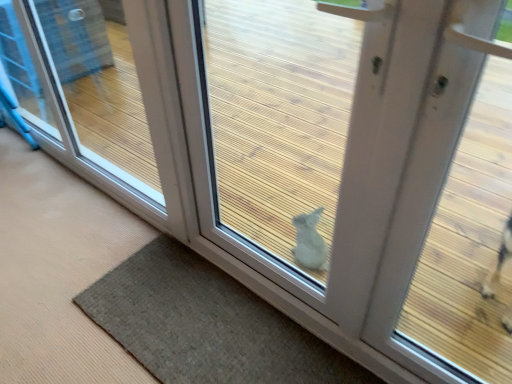
This screenshot has width=512, height=384. In order to click on transparent glass door at lower right in this screenshot , I will do `click(99, 89)`.

Looking at the image, does brown textured mat at lower center seem bigger or smaller compared to white matte door at center?

In the image, brown textured mat at lower center appears to be smaller than white matte door at center.

From the image's perspective, is brown textured mat at lower center located above or below white matte door at center?

brown textured mat at lower center is situated lower than white matte door at center in the image.

Does brown textured mat at lower center turn towards white matte door at center?

No, brown textured mat at lower center is not oriented towards white matte door at center.

Is brown textured mat at lower center beside white matte door at center?

brown textured mat at lower center is not next to white matte door at center, and they're not touching.

Which object is more forward, transparent glass door at lower right or brown textured mat at lower center?

Positioned in front is brown textured mat at lower center.

Is transparent glass door at lower right far from brown textured mat at lower center?

That's right, there is a large distance between transparent glass door at lower right and brown textured mat at lower center.

Is transparent glass door at lower right inside the boundaries of brown textured mat at lower center, or outside?

transparent glass door at lower right is not inside brown textured mat at lower center, it's outside.

From a real-world perspective, which object stands above the other?

transparent glass door at lower right, from a real-world perspective.

Is brown textured mat at lower center touching transparent glass door at lower right?

No, brown textured mat at lower center is not next to transparent glass door at lower right.

Which object is positioned more to the right, brown textured mat at lower center or transparent glass door at lower right?

brown textured mat at lower center is more to the right.

Based on the photo, is brown textured mat at lower center inside or outside of transparent glass door at lower right?

brown textured mat at lower center is outside transparent glass door at lower right.

From the picture: Between white matte door at center and transparent glass door at lower right, which one has smaller width?

Thinner between the two is white matte door at center.

From the image's perspective, which object appears higher, white matte door at center or transparent glass door at lower right?

transparent glass door at lower right appears higher in the image.

Which is farther, [323,13] or [51,67]?

The point [323,13] is farther from the camera.

Looking at this image, does white matte door at center turn towards brown textured mat at lower center?

Yes, white matte door at center is oriented towards brown textured mat at lower center.

From the image's perspective, is white matte door at center above or below brown textured mat at lower center?

white matte door at center is above brown textured mat at lower center.

Which object is positioned more to the right, white matte door at center or brown textured mat at lower center?

Positioned to the right is white matte door at center.

Does transparent glass door at lower right turn towards white matte door at center?

No, transparent glass door at lower right is not turned towards white matte door at center.

How different are the orientations of transparent glass door at lower right and white matte door at center in degrees?

The facing directions of transparent glass door at lower right and white matte door at center are 0.542 degrees apart.

Is transparent glass door at lower right touching white matte door at center?

No, transparent glass door at lower right is not next to white matte door at center.

Is the depth of transparent glass door at lower right less than that of white matte door at center?

No.

Locate an element on the screen. This screenshot has width=512, height=384. door above the brown textured mat at lower center (from a real-world perspective) is located at coordinates (298, 136).

Locate an element on the screen. mat that appears on the right of transparent glass door at lower right is located at coordinates (206, 325).

From the image, which object appears to be nearer to transparent glass door at lower right, brown textured mat at lower center or white matte door at center?

white matte door at center.

From the image, which object appears to be farther from brown textured mat at lower center, white matte door at center or transparent glass door at lower right?

transparent glass door at lower right.

When comparing their distances from brown textured mat at lower center, does transparent glass door at lower right or white matte door at center seem closer?

white matte door at center.

Considering their positions, is transparent glass door at lower right positioned closer to white matte door at center than brown textured mat at lower center?

Based on the image, brown textured mat at lower center appears to be nearer to white matte door at center.

When comparing their distances from white matte door at center, does brown textured mat at lower center or transparent glass door at lower right seem closer?

Among the two, brown textured mat at lower center is located nearer to white matte door at center.

Which object lies further to the anchor point transparent glass door at lower right, white matte door at center or brown textured mat at lower center?

Based on the image, brown textured mat at lower center appears to be further to transparent glass door at lower right.

This screenshot has width=512, height=384. Identify the location of mat situated between transparent glass door at lower right and white matte door at center from left to right. (206, 325).